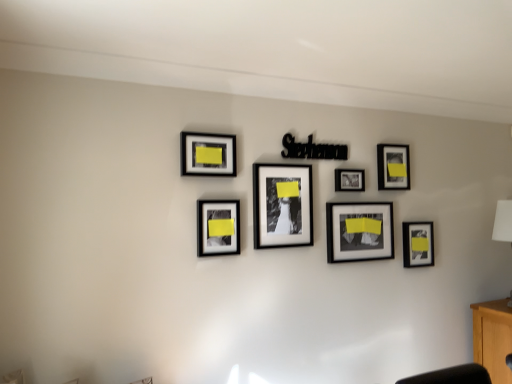
Question: Is matte black picture frame at upper right, which is the 2th picture frame in right-to-left order, not close to matte black frame at lower right, which appears as the seventh picture frame when viewed from the left?

Choices:
 (A) yes
 (B) no

Answer: (B)

Question: From the image's perspective, is matte black picture frame at upper right, which is the 2th picture frame in right-to-left order, on matte black frame at lower right, which appears as the seventh picture frame when viewed from the left?

Choices:
 (A) yes
 (B) no

Answer: (A)

Question: Can you confirm if matte black picture frame at upper right, which is the 2th picture frame in right-to-left order, is shorter than matte black frame at lower right, which appears as the seventh picture frame when viewed from the left?

Choices:
 (A) yes
 (B) no

Answer: (B)

Question: Does matte black picture frame at upper right, positioned as the sixth picture frame in left-to-right order, have a lesser width compared to matte black frame at lower right, which appears as the seventh picture frame when viewed from the left?

Choices:
 (A) yes
 (B) no

Answer: (A)

Question: Considering the relative sizes of matte black picture frame at upper right, which is the 2th picture frame in right-to-left order, and matte black frame at lower right, which appears as the seventh picture frame when viewed from the left, in the image provided, is matte black picture frame at upper right, which is the 2th picture frame in right-to-left order, taller than matte black frame at lower right, which appears as the seventh picture frame when viewed from the left,?

Choices:
 (A) no
 (B) yes

Answer: (B)

Question: Considering the relative positions of matte black picture frame at upper right, which is the 2th picture frame in right-to-left order, and matte black frame at lower right, which appears as the seventh picture frame when viewed from the left, in the image provided, is matte black picture frame at upper right, which is the 2th picture frame in right-to-left order, to the left of matte black frame at lower right, which appears as the seventh picture frame when viewed from the left, from the viewer's perspective?

Choices:
 (A) yes
 (B) no

Answer: (A)

Question: Are matte black picture frame at upper right, positioned as the sixth picture frame in left-to-right order, and black matte picture frame at center, marked as the 4th picture frame in a left-to-right arrangement, making contact?

Choices:
 (A) no
 (B) yes

Answer: (A)

Question: From a real-world perspective, is matte black picture frame at upper right, which is the 2th picture frame in right-to-left order, positioned over black matte picture frame at center, the 4th picture frame when ordered from right to left, based on gravity?

Choices:
 (A) no
 (B) yes

Answer: (B)

Question: Is matte black picture frame at upper right, which is the 2th picture frame in right-to-left order, positioned before black matte picture frame at center, marked as the 4th picture frame in a left-to-right arrangement?

Choices:
 (A) no
 (B) yes

Answer: (A)

Question: Considering the relative sizes of matte black picture frame at upper right, which is the 2th picture frame in right-to-left order, and black matte picture frame at center, the 4th picture frame when ordered from right to left, in the image provided, is matte black picture frame at upper right, which is the 2th picture frame in right-to-left order, wider than black matte picture frame at center, the 4th picture frame when ordered from right to left,?

Choices:
 (A) no
 (B) yes

Answer: (A)

Question: Is matte black picture frame at upper right, which is the 2th picture frame in right-to-left order, oriented away from black matte picture frame at center, the 4th picture frame when ordered from right to left?

Choices:
 (A) no
 (B) yes

Answer: (A)

Question: Is matte black picture frame at upper right, positioned as the sixth picture frame in left-to-right order, at the right side of black matte picture frame at center, marked as the 4th picture frame in a left-to-right arrangement?

Choices:
 (A) no
 (B) yes

Answer: (B)

Question: Is beech wood cabinet at lower right thinner than white fabric lampshade at right?

Choices:
 (A) no
 (B) yes

Answer: (A)